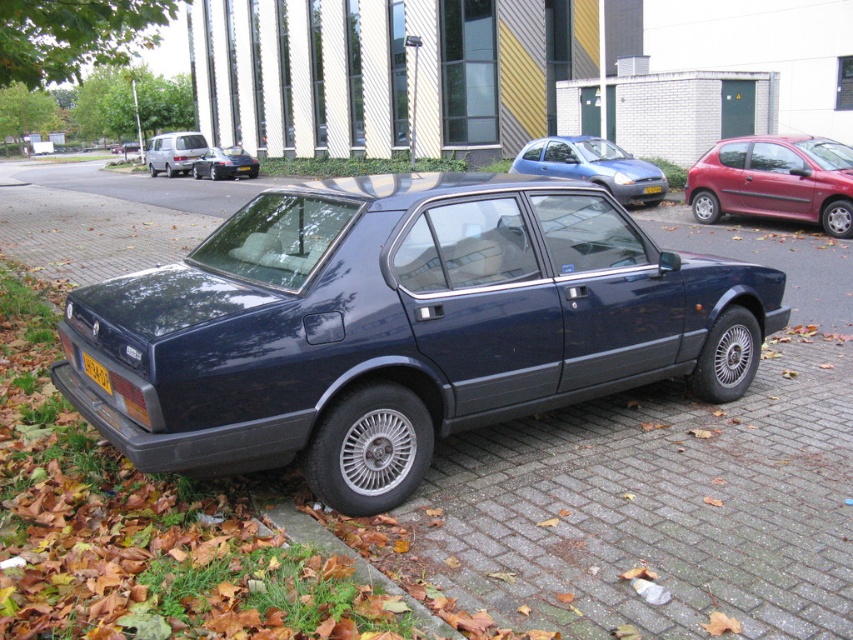
You are standing in front of a dark blue sedan parked on a paved area. You want to take a photo of the brick pavement at lower center. Where exactly should you point your camera?

You should point your camera at point (352, 563) to capture the brick pavement at lower center.

You are a delivery driver who needs to park your truck next to the matte blue sedan at center. The brick pavement at lower center is the only available space. Can you fit your truck there if your truck is 2 meters wide?

The matte blue sedan at center might be wider than brick pavement at lower center, so it is uncertain if the truck can fit. The driver should measure the space or look for another parking spot.

You are standing at the back of the dark blue sedan and want to walk to the front. Which point, point [526,163] or point [169,145], is closer to you?

Point [169,145] is closer to you because it is behind point [526,163].